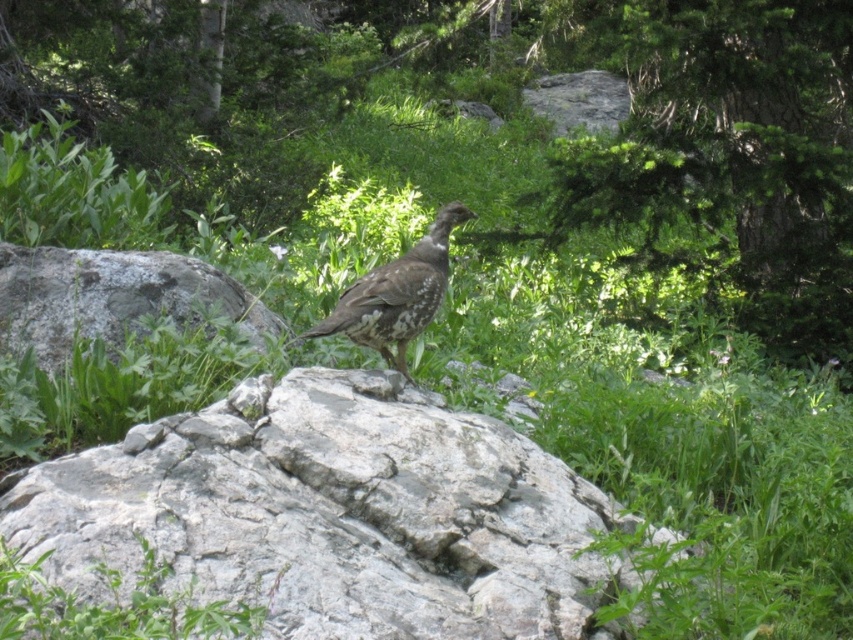
Is gray rock at center to the right of gray rough boulder at center from the viewer's perspective?

Yes, gray rock at center is to the right of gray rough boulder at center.

This screenshot has width=853, height=640. What do you see at coordinates (334, 515) in the screenshot?
I see `gray rock at center` at bounding box center [334, 515].

Where is `gray rock at center`? The image size is (853, 640). gray rock at center is located at coordinates (334, 515).

Between green textured tree at upper center and speckled brown bird at center, which one appears on the left side from the viewer's perspective?

Positioned to the left is speckled brown bird at center.

Consider the image. Is green textured tree at upper center wider than speckled brown bird at center?

Indeed, green textured tree at upper center has a greater width compared to speckled brown bird at center.

Is point (703, 116) behind point (425, 234)?

That is True.

Where is `green textured tree at upper center`? This screenshot has width=853, height=640. green textured tree at upper center is located at coordinates (735, 154).

Does gray rock at center have a greater width compared to green textured tree at upper center?

In fact, gray rock at center might be narrower than green textured tree at upper center.

Is point (544, 536) positioned after point (827, 134)?

That is False.

The height and width of the screenshot is (640, 853). What are the coordinates of `gray rock at center` in the screenshot? It's located at (334, 515).